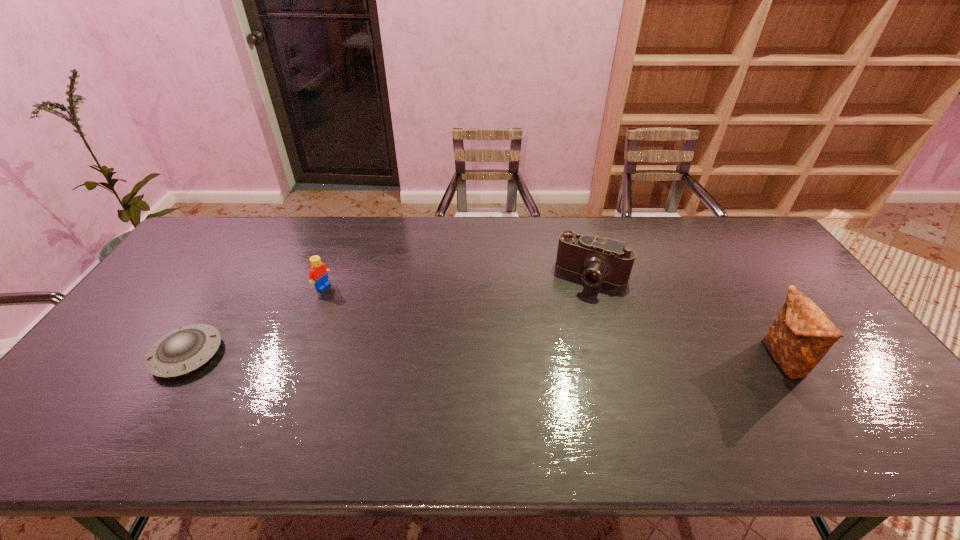
This screenshot has height=540, width=960. In order to click on the shortest object in this screenshot , I will do `click(185, 349)`.

Locate an element on the screen. Image resolution: width=960 pixels, height=540 pixels. the leftmost object is located at coordinates (185, 349).

Identify the location of clutch bag. (802, 334).

At what (x,y) coordinates should I click in order to perform the action: click on the rightmost object. Please return your answer as a coordinate pair (x, y). Looking at the image, I should click on (802, 334).

The width and height of the screenshot is (960, 540). I want to click on camera, so click(596, 259).

Locate an element on the screen. the third object from right to left is located at coordinates (318, 275).

The image size is (960, 540). Find the location of `vacant space situated 0.200m on the back of the saucer`. vacant space situated 0.200m on the back of the saucer is located at coordinates (233, 281).

In order to click on free space located on the open side of the tallest object in this screenshot , I will do `click(651, 360)`.

Where is `vacant space located 0.280m on the open side of the tallest object`? Image resolution: width=960 pixels, height=540 pixels. vacant space located 0.280m on the open side of the tallest object is located at coordinates (659, 360).

At what (x,y) coordinates should I click in order to perform the action: click on vacant area situated on the open side of the tallest object. Please return your answer as a coordinate pair (x, y). Looking at the image, I should click on (678, 360).